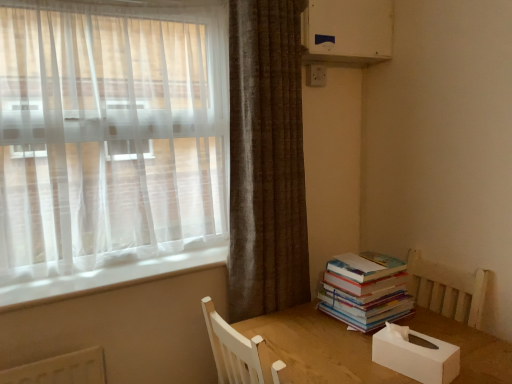
The width and height of the screenshot is (512, 384). In order to click on empty space that is ontop of white plastic window sill at lower left (from a real-world perspective) in this screenshot , I will do `click(134, 264)`.